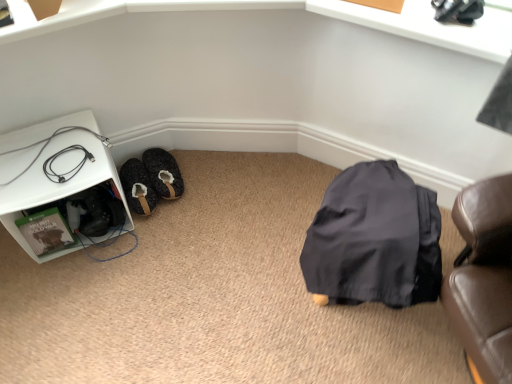
I want to click on vacant space situated above white plastic shelf at left (from a real-world perspective), so click(42, 156).